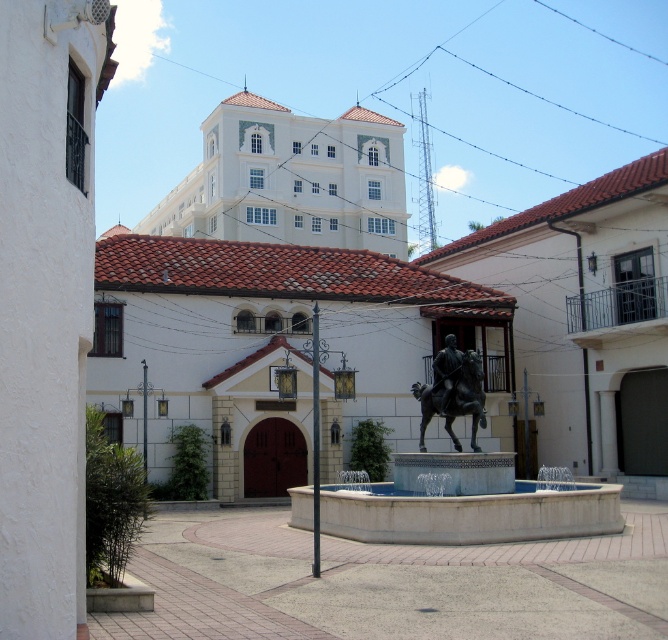
Can you confirm if white tile church at upper center is taller than white marble fountain at center?

Yes.

Describe the element at coordinates (291, 179) in the screenshot. This screenshot has width=668, height=640. I see `white tile church at upper center` at that location.

At what (x,y) coordinates should I click in order to perform the action: click on white tile church at upper center. Please return your answer as a coordinate pair (x, y). Looking at the image, I should click on (291, 179).

Is point (448, 476) positioned behind point (442, 388)?

No.

Which of these two, white marble fountain at center or bronze statue at center, stands taller?

Standing taller between the two is white marble fountain at center.

Where is `white marble fountain at center`? white marble fountain at center is located at coordinates (462, 492).

What are the coordinates of `white marble fountain at center` in the screenshot? It's located at (462, 492).

Is gray concrete courtyard at center further to camera compared to white tile church at upper center?

That is False.

Is point (178, 602) positioned before point (184, 220)?

Yes, it is.

Where is `gray concrete courtyard at center`? Image resolution: width=668 pixels, height=640 pixels. gray concrete courtyard at center is located at coordinates pos(391,582).